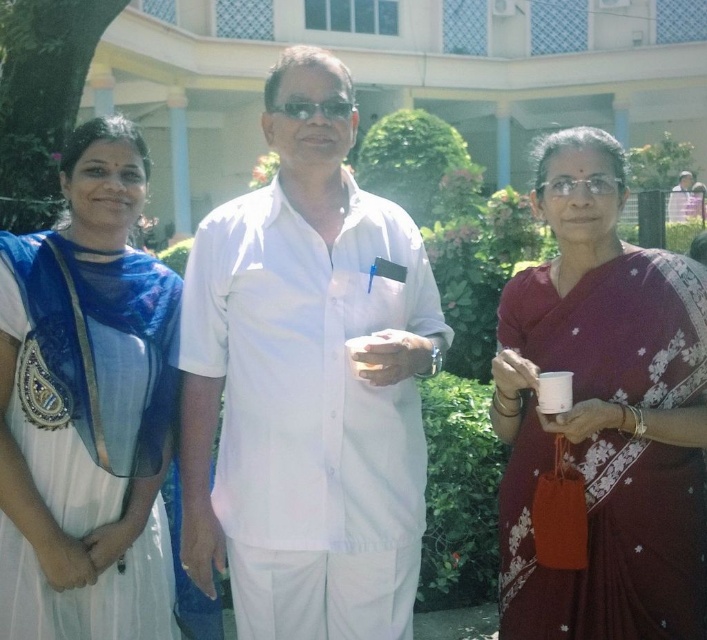
Does maroon silk saree at right come behind white silk saree at left?

That is True.

Is point (699, 458) farther from camera compared to point (140, 198)?

No, it is not.

In order to click on maroon silk saree at right in this screenshot , I will do `click(602, 412)`.

You are a GUI agent. You are given a task and a screenshot of the screen. Output one action in this format:
    pyautogui.click(x=<x>, y=<y>)
    Task: Click on the white matte shirt at center
    The image size is (707, 640).
    Given the screenshot: What is the action you would take?
    pyautogui.click(x=308, y=381)

Does white matte shirt at center appear on the right side of maroon silk saree at right?

Incorrect, white matte shirt at center is not on the right side of maroon silk saree at right.

Identify the location of white matte shirt at center. This screenshot has width=707, height=640. (308, 381).

This screenshot has height=640, width=707. I want to click on white matte shirt at center, so click(308, 381).

Measure the distance between white matte shirt at center and white silk saree at left.

white matte shirt at center and white silk saree at left are 23.14 inches apart.

Is the position of white matte shirt at center less distant than that of white silk saree at left?

No, white matte shirt at center is further to the viewer.

Describe the element at coordinates (308, 381) in the screenshot. This screenshot has height=640, width=707. I see `white matte shirt at center` at that location.

I want to click on white matte shirt at center, so click(x=308, y=381).